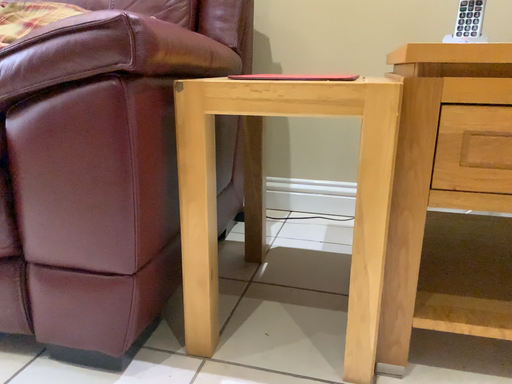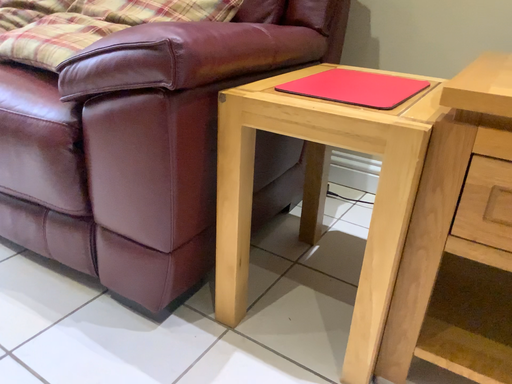
Question: Which way did the camera rotate in the video?

Choices:
 (A) rotated left
 (B) rotated right

Answer: (A)